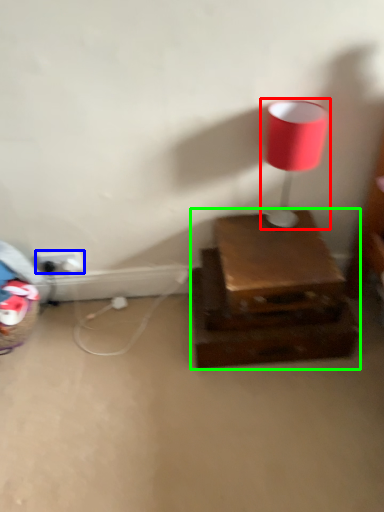
Question: Estimate the real-world distances between objects in this image. Which object is farther from lamp (highlighted by a red box), electric outlet (highlighted by a blue box) or furniture (highlighted by a green box)?

Choices:
 (A) electric outlet
 (B) furniture

Answer: (A)